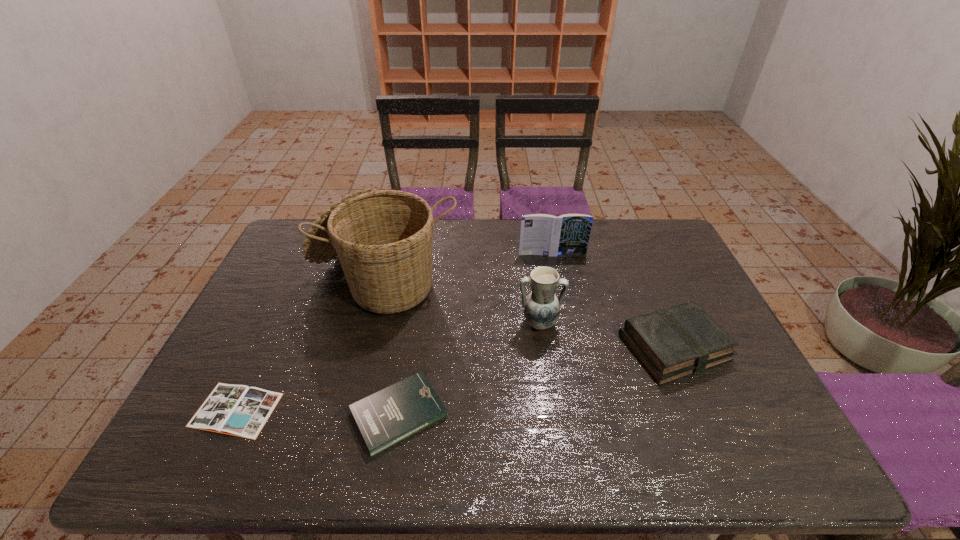
The image size is (960, 540). What are the coordinates of `object that is positioned at the right edge` in the screenshot? It's located at (672, 343).

The width and height of the screenshot is (960, 540). What are the coordinates of `object at the far left corner` in the screenshot? It's located at (383, 238).

Locate an element on the screen. Image resolution: width=960 pixels, height=540 pixels. object located in the near left corner section of the desktop is located at coordinates (238, 410).

In the image, there is a desktop. Where is `vacant region at the far edge`? The width and height of the screenshot is (960, 540). vacant region at the far edge is located at coordinates (613, 259).

Identify the location of blank space at the near edge of the desktop. The width and height of the screenshot is (960, 540). tap(438, 443).

The image size is (960, 540). In order to click on free space at the left edge of the desktop in this screenshot , I will do `click(198, 401)`.

Locate an element on the screen. vacant space at the right edge of the desktop is located at coordinates (724, 426).

You are a GUI agent. You are given a task and a screenshot of the screen. Output one action in this format:
    pyautogui.click(x=<x>, y=<y>)
    Task: Click on the free region at the far right corner
    
    Given the screenshot: What is the action you would take?
    pyautogui.click(x=670, y=254)

Find the location of a particular element. The image size is (960, 540). vacant area between the third tallest book and the pottery is located at coordinates (469, 369).

Find the location of a particular element. The width and height of the screenshot is (960, 540). free spot between the pottery and the second book from left to right is located at coordinates (469, 369).